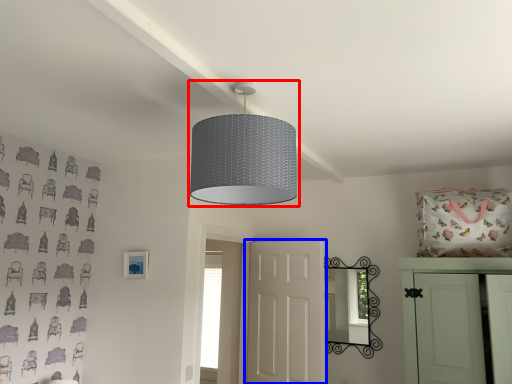
Question: Which point is closer to the camera, lamp (highlighted by a red box) or door (highlighted by a blue box)?

Choices:
 (A) lamp
 (B) door

Answer: (A)